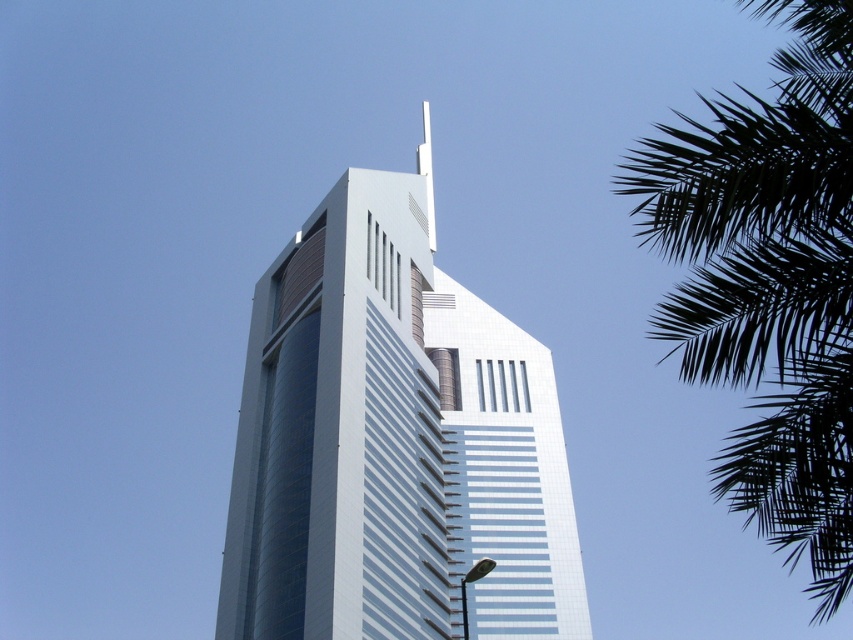
Question: Considering the relative positions of white glass building at center and green leafy palm at upper right in the image provided, where is white glass building at center located with respect to green leafy palm at upper right?

Choices:
 (A) above
 (B) below

Answer: (A)

Question: Which point is closer to the camera?

Choices:
 (A) (688, 211)
 (B) (287, 609)

Answer: (A)

Question: Which of the following is the farthest from the observer?

Choices:
 (A) (726, 323)
 (B) (532, 342)

Answer: (B)

Question: Which point is closer to the camera?

Choices:
 (A) (822, 548)
 (B) (437, 268)

Answer: (A)

Question: Can you confirm if white glass building at center is smaller than green leafy palm at upper right?

Choices:
 (A) no
 (B) yes

Answer: (B)

Question: Can you confirm if white glass building at center is bigger than green leafy palm at upper right?

Choices:
 (A) yes
 (B) no

Answer: (B)